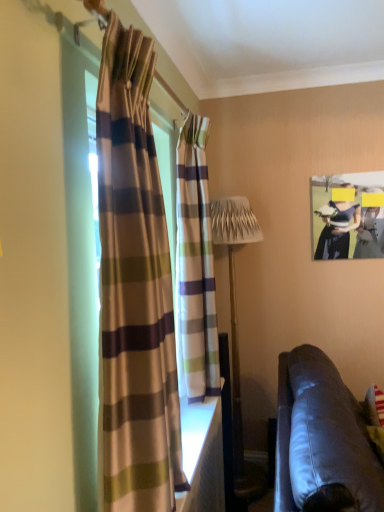
Describe the element at coordinates (237, 329) in the screenshot. I see `metallic silver table lamp at center` at that location.

Where is `metallic silver table lamp at center`? metallic silver table lamp at center is located at coordinates (237, 329).

What do you see at coordinates (195, 267) in the screenshot? I see `striped fabric curtain at center, which ranks as the 1th curtain in back-to-front order` at bounding box center [195, 267].

Find the location of a particular element. The image size is (384, 512). striped fabric curtain at left, which appears as the first curtain when viewed from the front is located at coordinates (134, 291).

You are a GUI agent. You are given a task and a screenshot of the screen. Output one action in this format:
    pyautogui.click(x=<x>, y=<y>)
    Task: Click on the leather couch at lower right
    The image size is (384, 512).
    Given the screenshot: What is the action you would take?
    pyautogui.click(x=321, y=435)

At what (x,y) coordinates should I click in order to perform the action: click on metallic silver table lamp at center. Please return your answer as a coordinate pair (x, y). The image size is (384, 512). Looking at the image, I should click on (237, 329).

In the scene shown: Which point is more distant from viewer, (215, 353) or (303, 473)?

Point (215, 353)

Relative to leather couch at lower right, is striped fabric curtain at center, which is counted as the second curtain, starting from the front, in front or behind?

striped fabric curtain at center, which is counted as the second curtain, starting from the front, is positioned farther from the viewer than leather couch at lower right.

Is striped fabric curtain at center, which is counted as the second curtain, starting from the front, facing towards leather couch at lower right?

No, striped fabric curtain at center, which is counted as the second curtain, starting from the front, is not turned towards leather couch at lower right.

The image size is (384, 512). What are the coordinates of `person on the right of striped fabric curtain at left, which appears as the first curtain when viewed from the front` in the screenshot? It's located at (337, 229).

Which is closer, (125, 488) or (322, 239)?

Point (125, 488) is positioned closer to the camera compared to point (322, 239).

From the image's perspective, who appears lower, striped fabric curtain at left, which appears as the first curtain when viewed from the front, or matte black hat at upper right?

striped fabric curtain at left, which appears as the first curtain when viewed from the front, appears lower in the image.

Is striped fabric curtain at left, which is the 2th curtain in back-to-front order, facing away from matte black hat at upper right?

striped fabric curtain at left, which is the 2th curtain in back-to-front order, is not turned away from matte black hat at upper right.

Which object is further away from the camera, striped fabric curtain at center, which ranks as the 1th curtain in back-to-front order, or matte black hat at upper right?

matte black hat at upper right is more distant.

From the image's perspective, is striped fabric curtain at center, which ranks as the 1th curtain in back-to-front order, on top of matte black hat at upper right?

Incorrect, from the image's perspective, striped fabric curtain at center, which ranks as the 1th curtain in back-to-front order, is lower than matte black hat at upper right.

From the image's perspective, which curtain is the 1st one below the matte black hat at upper right? Please provide its 2D coordinates.

[(195, 267)]

Is matte black hat at upper right surrounded by striped fabric curtain at center, which ranks as the 1th curtain in back-to-front order?

Actually, matte black hat at upper right is outside striped fabric curtain at center, which ranks as the 1th curtain in back-to-front order.

Which curtain is the 2nd one when counting from the front of the metallic silver table lamp at center? Please provide its 2D coordinates.

[(134, 291)]

From the image's perspective, is striped fabric curtain at left, which appears as the first curtain when viewed from the front, below metallic silver table lamp at center?

No, from the image's perspective, striped fabric curtain at left, which appears as the first curtain when viewed from the front, is not below metallic silver table lamp at center.

Which is behind, striped fabric curtain at left, which appears as the first curtain when viewed from the front, or metallic silver table lamp at center?

metallic silver table lamp at center is further from the camera.

Measure the distance between striped fabric curtain at left, which is the 2th curtain in back-to-front order, and metallic silver table lamp at center.

striped fabric curtain at left, which is the 2th curtain in back-to-front order, is 1.48 meters away from metallic silver table lamp at center.

Between metallic silver table lamp at center and leather couch at lower right, which one has smaller width?

With smaller width is metallic silver table lamp at center.

From the image's perspective, which is below, metallic silver table lamp at center or leather couch at lower right?

leather couch at lower right, from the image's perspective.

Looking at this image, from a real-world perspective, which is physically below, metallic silver table lamp at center or leather couch at lower right?

leather couch at lower right is physically lower.

Is leather couch at lower right turned away from striped fabric curtain at left, which appears as the first curtain when viewed from the front?

No, leather couch at lower right is not facing away from striped fabric curtain at left, which appears as the first curtain when viewed from the front.

Is point (339, 418) behind point (141, 401)?

That is True.

Between leather couch at lower right and striped fabric curtain at left, which appears as the first curtain when viewed from the front, which one appears on the left side from the viewer's perspective?

From the viewer's perspective, striped fabric curtain at left, which appears as the first curtain when viewed from the front, appears more on the left side.

Is striped fabric curtain at center, which ranks as the 1th curtain in back-to-front order, located outside metallic silver table lamp at center?

Yes, striped fabric curtain at center, which ranks as the 1th curtain in back-to-front order, is outside of metallic silver table lamp at center.

From the image's perspective, is striped fabric curtain at center, which is counted as the second curtain, starting from the front, positioned above or below metallic silver table lamp at center?

striped fabric curtain at center, which is counted as the second curtain, starting from the front, is situated higher than metallic silver table lamp at center in the image.

Could you tell me if striped fabric curtain at center, which is counted as the second curtain, starting from the front, is facing metallic silver table lamp at center?

No, striped fabric curtain at center, which is counted as the second curtain, starting from the front, is not turned towards metallic silver table lamp at center.

From a real-world perspective, is striped fabric curtain at center, which ranks as the 1th curtain in back-to-front order, beneath metallic silver table lamp at center?

No.

From a real-world perspective, count 2nd curtains upward from the leather couch at lower right and point to it. Please provide its 2D coordinates.

[(195, 267)]

Locate an element on the screen. The width and height of the screenshot is (384, 512). person above the striped fabric curtain at left, which is the 2th curtain in back-to-front order (from the image's perspective) is located at coordinates (337, 229).

When comparing their distances from leather couch at lower right, does striped fabric curtain at left, which appears as the first curtain when viewed from the front, or metallic silver table lamp at center seem further?

metallic silver table lamp at center is positioned further to the anchor leather couch at lower right.

Considering their positions, is metallic silver table lamp at center positioned closer to striped fabric curtain at center, which is counted as the second curtain, starting from the front, than leather couch at lower right?

Among the two, leather couch at lower right is located nearer to striped fabric curtain at center, which is counted as the second curtain, starting from the front.

Looking at the image, which one is located further to leather couch at lower right, metallic silver table lamp at center or matte black hat at upper right?

Among the two, matte black hat at upper right is located further to leather couch at lower right.

Looking at the image, which one is located further to matte black hat at upper right, striped fabric curtain at left, which appears as the first curtain when viewed from the front, or metallic silver table lamp at center?

striped fabric curtain at left, which appears as the first curtain when viewed from the front.

Estimate the real-world distances between objects in this image. Which object is further from leather couch at lower right, striped fabric curtain at left, which appears as the first curtain when viewed from the front, or striped fabric curtain at center, which ranks as the 1th curtain in back-to-front order?

Among the two, striped fabric curtain at left, which appears as the first curtain when viewed from the front, is located further to leather couch at lower right.

Based on their spatial positions, is matte black hat at upper right or leather couch at lower right further from striped fabric curtain at left, which is the 2th curtain in back-to-front order?

The object further to striped fabric curtain at left, which is the 2th curtain in back-to-front order, is matte black hat at upper right.

Looking at the image, which one is located closer to striped fabric curtain at center, which ranks as the 1th curtain in back-to-front order, leather couch at lower right or metallic silver table lamp at center?

Among the two, leather couch at lower right is located nearer to striped fabric curtain at center, which ranks as the 1th curtain in back-to-front order.

Looking at this image, considering their positions, is leather couch at lower right positioned further to metallic silver table lamp at center than striped fabric curtain at center, which ranks as the 1th curtain in back-to-front order?

leather couch at lower right is further to metallic silver table lamp at center.

Locate an element on the screen. table lamp between leather couch at lower right and matte black hat at upper right in the front-back direction is located at coordinates (237, 329).

I want to click on curtain between striped fabric curtain at left, which appears as the first curtain when viewed from the front, and matte black hat at upper right, along the z-axis, so click(x=195, y=267).

Identify the location of curtain between striped fabric curtain at center, which ranks as the 1th curtain in back-to-front order, and leather couch at lower right, in the vertical direction. The width and height of the screenshot is (384, 512). (134, 291).

Image resolution: width=384 pixels, height=512 pixels. What are the coordinates of `curtain between striped fabric curtain at left, which is the 2th curtain in back-to-front order, and metallic silver table lamp at center from front to back` in the screenshot? It's located at (195, 267).